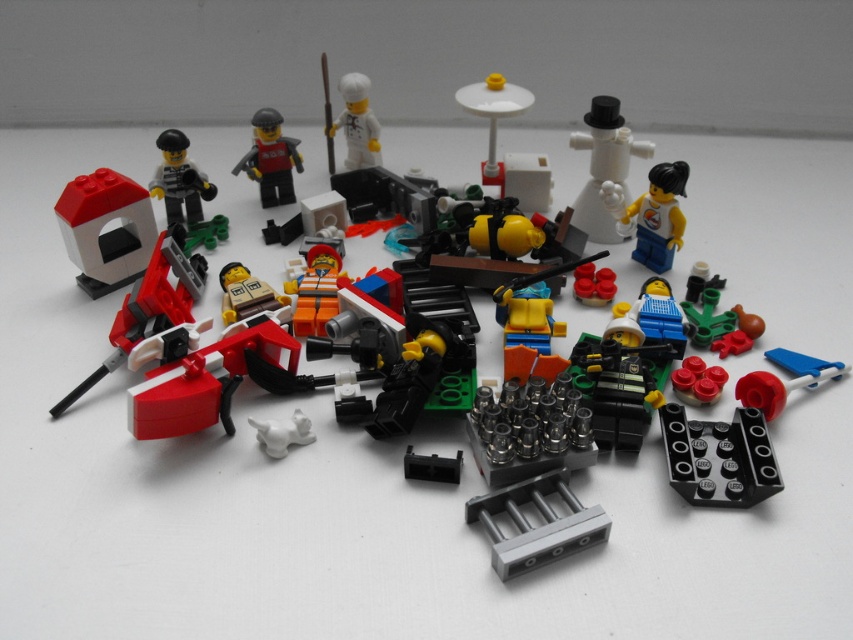
Question: Which point is closer to the camera?

Choices:
 (A) (265, 448)
 (B) (740, 490)
 (C) (241, 353)

Answer: (B)

Question: Does matte red house at left have a larger size compared to matte black minifigure at center?

Choices:
 (A) no
 (B) yes

Answer: (B)

Question: Which object is the farthest from the matte red house at left?

Choices:
 (A) matte black minifigure at center
 (B) white matte wedding dress at upper right

Answer: (B)

Question: Which point is closer to the camera?

Choices:
 (A) white glossy minifigure at upper right
 (B) white matte chef hat at upper center
 (C) matte black minifigure at center
 (D) black plastic plate at lower right

Answer: (D)

Question: Is shiny red plastic airplane at center-left to the left of matte red plastic gun at lower left from the viewer's perspective?

Choices:
 (A) no
 (B) yes

Answer: (A)

Question: Can you confirm if shiny red plastic airplane at center-left is positioned to the right of matte black minifigure at upper left?

Choices:
 (A) no
 (B) yes

Answer: (B)